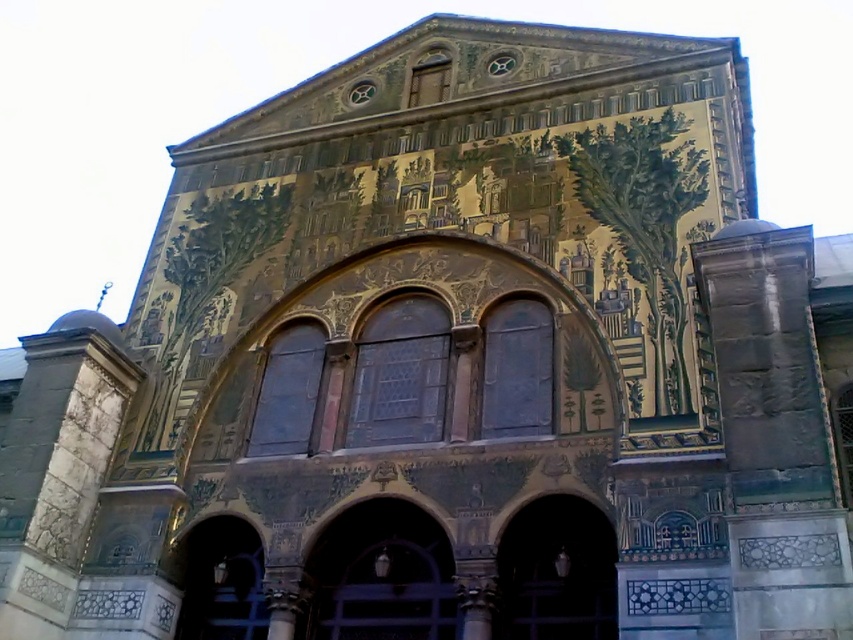
Question: Can you confirm if gray stone pillar at right is bigger than dark wood door at center?

Choices:
 (A) no
 (B) yes

Answer: (B)

Question: Can you confirm if dark wood door at center is wider than black glass door at center?

Choices:
 (A) no
 (B) yes

Answer: (B)

Question: Which is farther from the gray stone pillar at right?

Choices:
 (A) dark wood door at center
 (B) dark wood door at lower left
 (C) black glass door at center

Answer: (B)

Question: Estimate the real-world distances between objects in this image. Which object is closer to the black glass door at center?

Choices:
 (A) dark wood door at center
 (B) gray stone pillar at right
 (C) dark wood door at lower left

Answer: (A)

Question: Is gray stone pillar at right above dark wood door at lower left?

Choices:
 (A) yes
 (B) no

Answer: (A)

Question: Considering the real-world distances, which object is closest to the dark wood door at lower left?

Choices:
 (A) dark wood door at center
 (B) black glass door at center
 (C) gray stone pillar at right

Answer: (A)